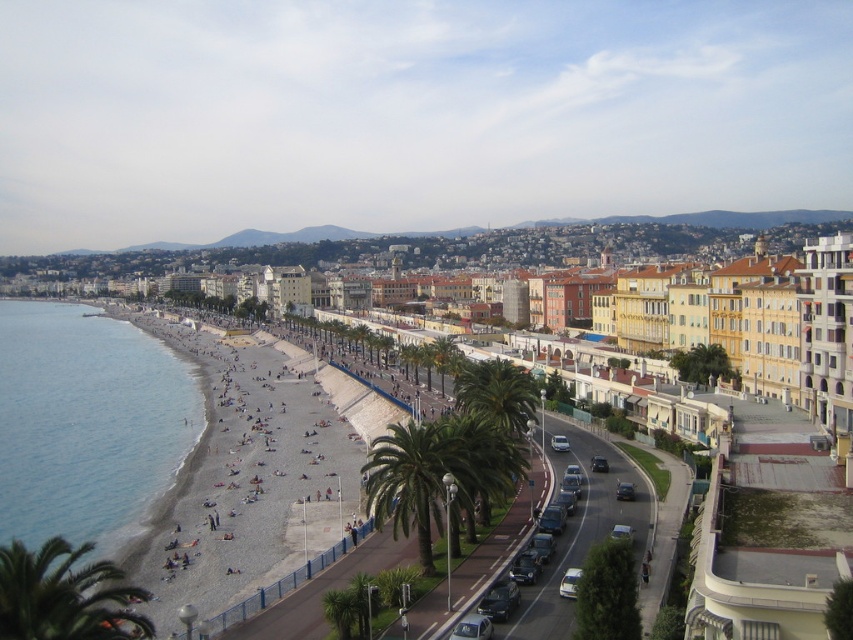
Does metallic silver car at center have a smaller size compared to shiny black sedan at center?

Yes.

Does metallic silver car at center lie behind shiny black sedan at center?

That is False.

What are the coordinates of `metallic silver car at center` in the screenshot? It's located at (473, 627).

Who is positioned more to the left, green leafy palm tree at center or silver metallic sedan at center-right?

green leafy palm tree at center is more to the left.

Locate an element on the screen. This screenshot has width=853, height=640. green leafy palm tree at center is located at coordinates (409, 477).

Locate an element on the screen. The width and height of the screenshot is (853, 640). green leafy palm tree at center is located at coordinates (409, 477).

Which of these two, satin black sedan at center-right or silver metallic sedan at center-right, stands taller?

silver metallic sedan at center-right is taller.

Describe the element at coordinates (625, 492) in the screenshot. The height and width of the screenshot is (640, 853). I see `satin black sedan at center-right` at that location.

Which is in front, point (622, 483) or point (561, 444)?

Point (622, 483) is more forward.

Find the location of a particular element. The width and height of the screenshot is (853, 640). satin black sedan at center-right is located at coordinates (625, 492).